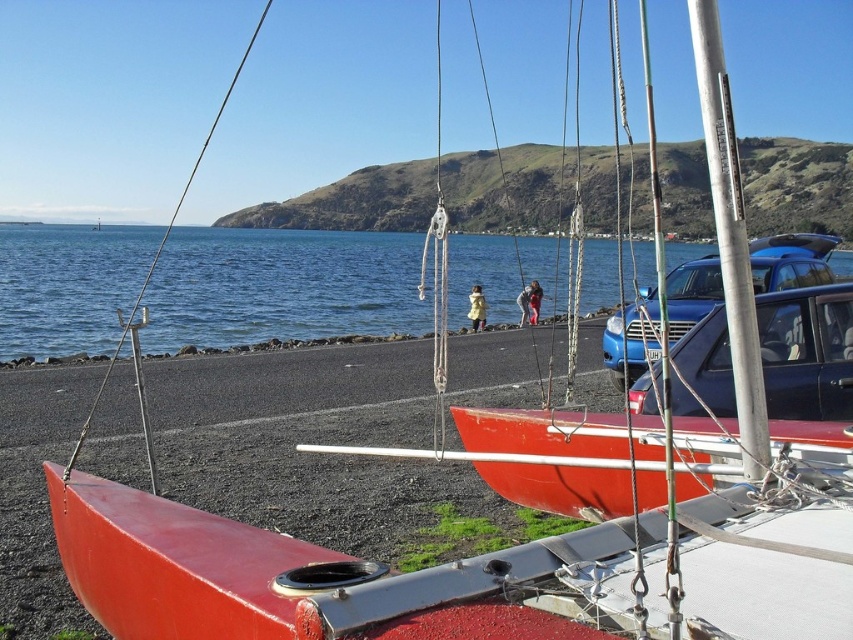
You are a photographer planning to take a wide shot of the coastal scene. You want to ensure that both the blue water at center and the blue metallic car at center are fully visible in your frame. Based on their sizes, which object should you prioritize positioning closer to the edge of the frame to avoid cropping?

The blue metallic car at center should be positioned closer to the edge of the frame because its width is smaller than the blue water at center, making it easier to fit without cropping.